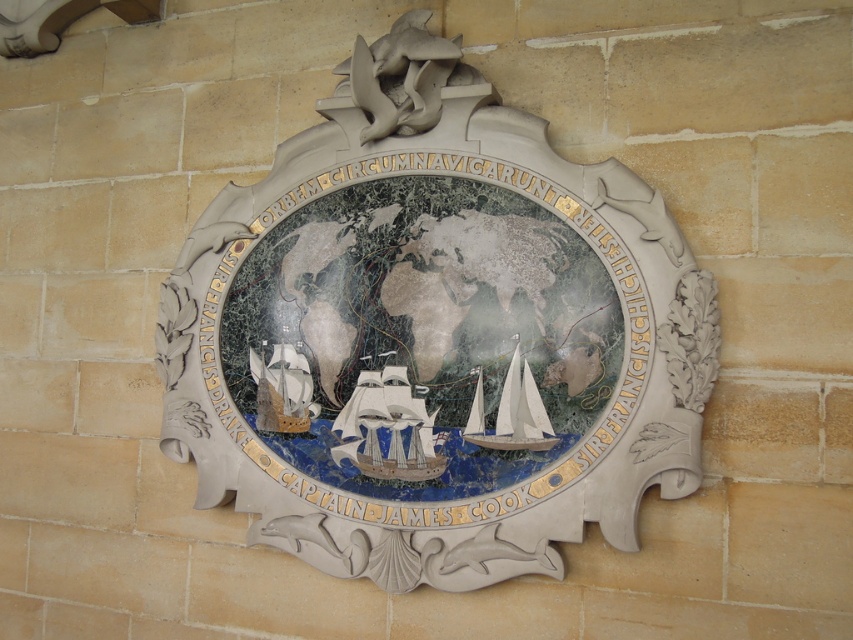
Does blue glossy ship at center lie behind white paper boat at lower left?

No, it is not.

Who is more distant from viewer, (421, 435) or (306, 371)?

The point (306, 371) is more distant.

What are the coordinates of `blue glossy ship at center` in the screenshot? It's located at (387, 428).

Does marble relief map at center have a lesser height compared to white glossy sailboat at center?

Incorrect, marble relief map at center's height does not fall short of white glossy sailboat at center's.

How distant is marble relief map at center from white glossy sailboat at center?

A distance of 12.09 inches exists between marble relief map at center and white glossy sailboat at center.

Between point (372, 188) and point (503, 388), which one is positioned behind?

Positioned behind is point (372, 188).

Find the location of a particular element. The image size is (853, 640). marble relief map at center is located at coordinates (438, 326).

Which is behind, point (509, 394) or point (276, 404)?

Positioned behind is point (276, 404).

Is point (543, 410) positioned behind point (270, 403)?

No, it is not.

Locate an element on the screen. This screenshot has height=640, width=853. white glossy sailboat at center is located at coordinates (512, 413).